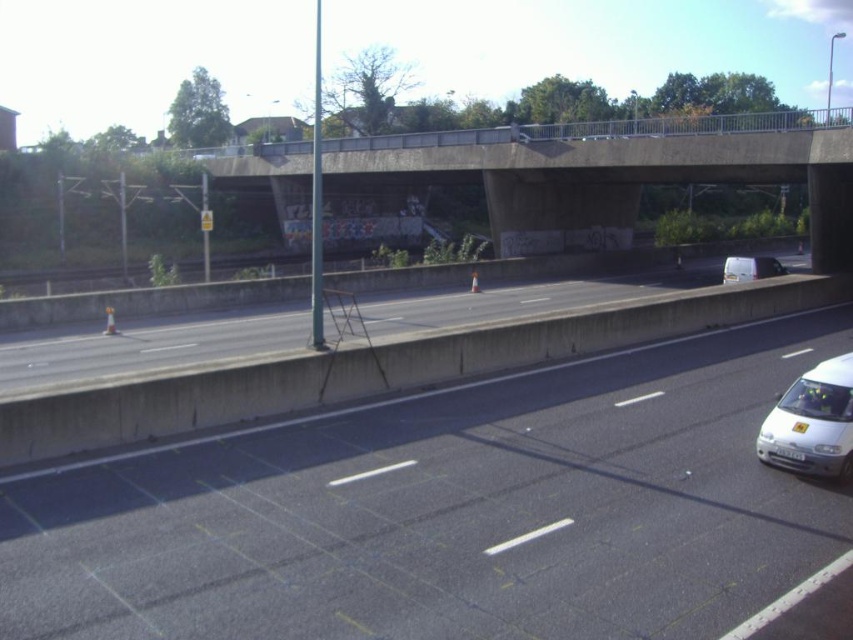
Question: Is gray concrete highway at center below white glossy car at lower right?

Choices:
 (A) yes
 (B) no

Answer: (B)

Question: Which object appears farthest from the camera in this image?

Choices:
 (A) black asphalt highway at center
 (B) white matte van at center
 (C) gray concrete highway at center
 (D) white glossy car at lower right

Answer: (B)

Question: Does black asphalt highway at center appear on the right side of white matte van at center?

Choices:
 (A) yes
 (B) no

Answer: (B)

Question: Which is farther from the white glossy car at lower right?

Choices:
 (A) gray concrete highway at center
 (B) white matte van at center

Answer: (B)

Question: Is the position of black asphalt highway at center more distant than that of gray concrete highway at center?

Choices:
 (A) no
 (B) yes

Answer: (A)

Question: Which object appears closest to the camera in this image?

Choices:
 (A) gray concrete highway at center
 (B) white matte van at center
 (C) black asphalt highway at center

Answer: (C)